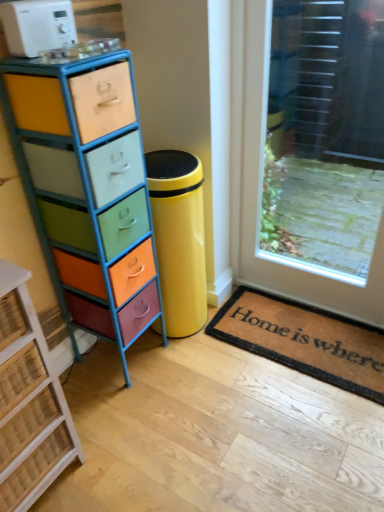
Locate an element on the screen. This screenshot has width=384, height=512. vacant point to the left of brown coir mat at lower right is located at coordinates tap(185, 388).